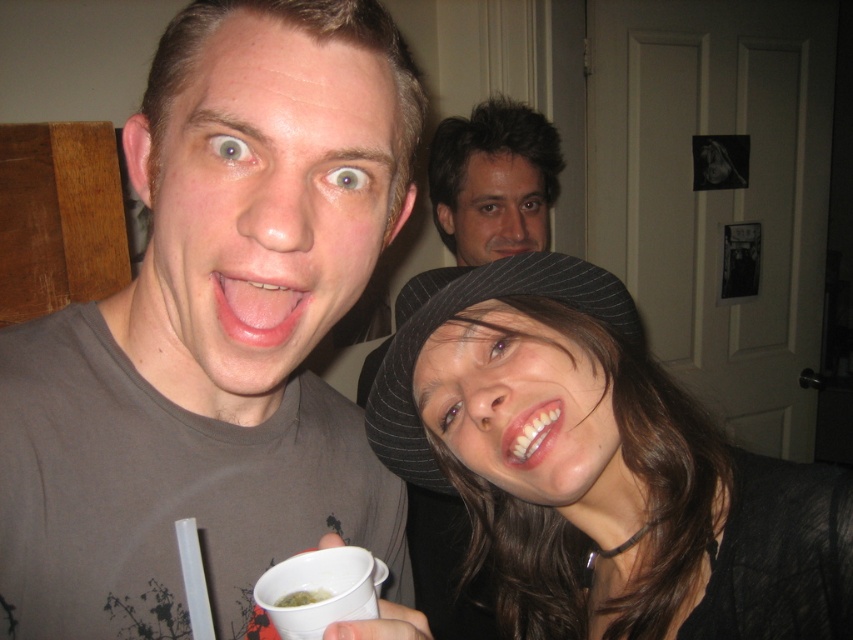
Can you confirm if matte gray t-shirt at center is positioned to the left of matte black hat at center?

Correct, you'll find matte gray t-shirt at center to the left of matte black hat at center.

Describe the element at coordinates (213, 332) in the screenshot. The width and height of the screenshot is (853, 640). I see `matte gray t-shirt at center` at that location.

Identify the location of matte gray t-shirt at center. (213, 332).

I want to click on matte gray t-shirt at center, so click(x=213, y=332).

Between pink glossy tongue at center and white glossy teeth at center, which one is positioned lower?

white glossy teeth at center is below.

Is pink glossy tongue at center to the right of white glossy teeth at center from the viewer's perspective?

Incorrect, pink glossy tongue at center is not on the right side of white glossy teeth at center.

Who is more forward, (293, 289) or (523, 419)?

Point (293, 289) is more forward.

Where is `pink glossy tongue at center`? This screenshot has height=640, width=853. pink glossy tongue at center is located at coordinates (256, 308).

Is matte black hat at center to the left of green liquid at cup center from the viewer's perspective?

Incorrect, matte black hat at center is not on the left side of green liquid at cup center.

Looking at this image, can you confirm if matte black hat at center is shorter than green liquid at cup center?

No, matte black hat at center is not shorter than green liquid at cup center.

The height and width of the screenshot is (640, 853). What are the coordinates of `matte black hat at center` in the screenshot? It's located at (604, 470).